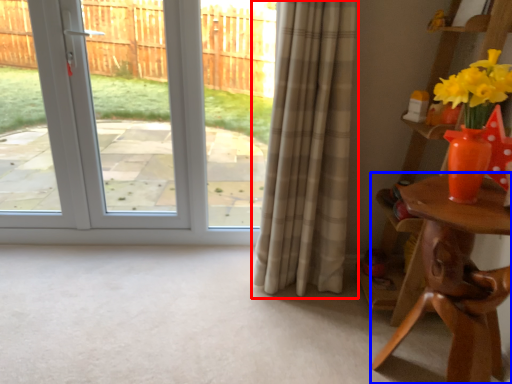
Question: Which of the following is the closest to the observer, curtain (highlighted by a red box) or table (highlighted by a blue box)?

Choices:
 (A) curtain
 (B) table

Answer: (B)